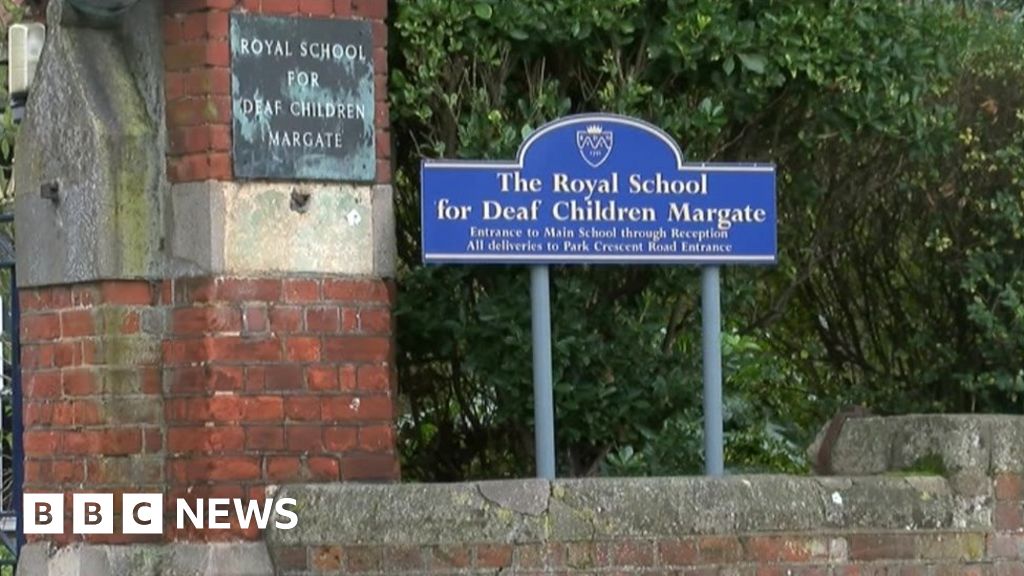
The width and height of the screenshot is (1024, 576). I want to click on sign on brick wall, so click(x=302, y=103).